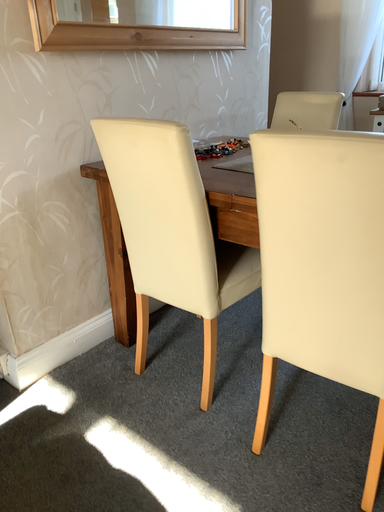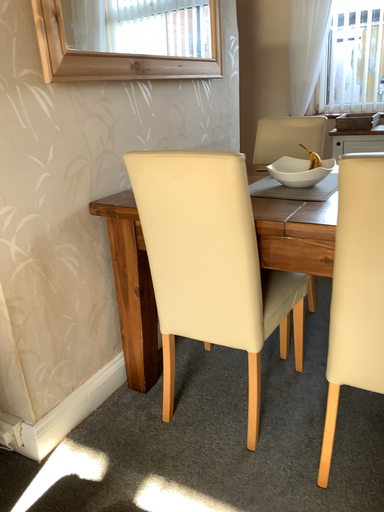
Question: How did the camera likely rotate when shooting the video?

Choices:
 (A) rotated right
 (B) rotated left

Answer: (A)